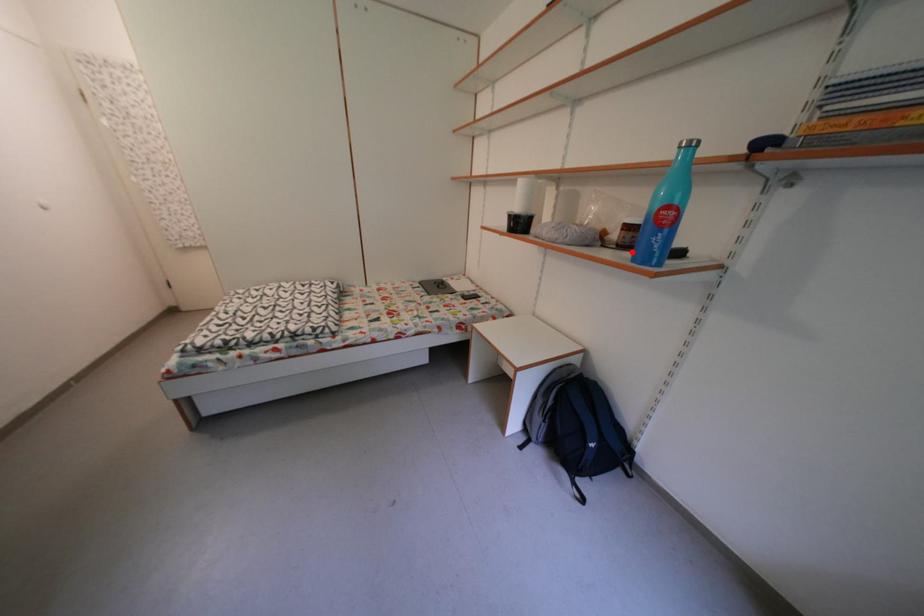
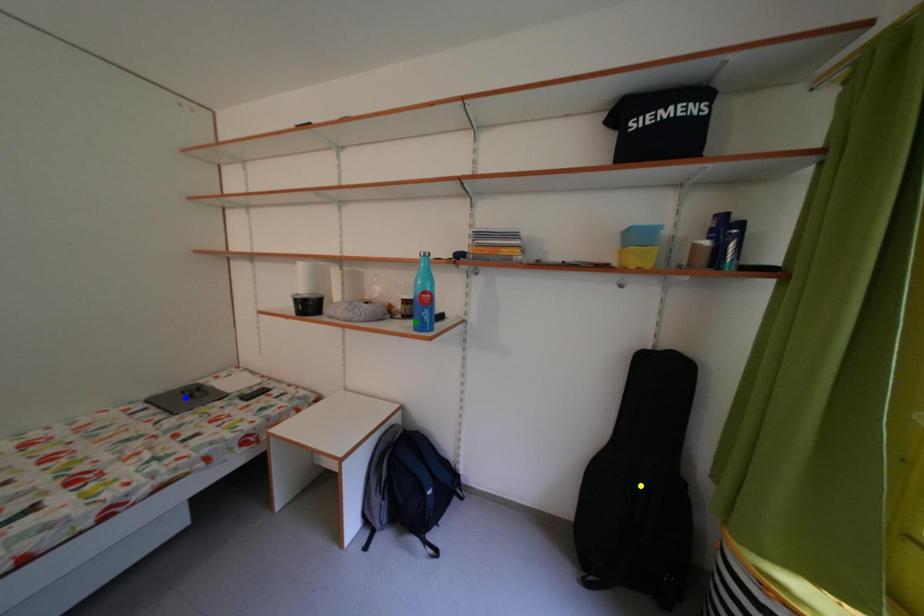
Question: I am providing you with two images of the same scene from different viewpoints. A red point is marked on the first image. You are given multiple points on the second image. In image 2, which mark is for the same physical point as the one in image 1?

Choices:
 (A) blue point
 (B) yellow point
 (C) green point

Answer: (C)